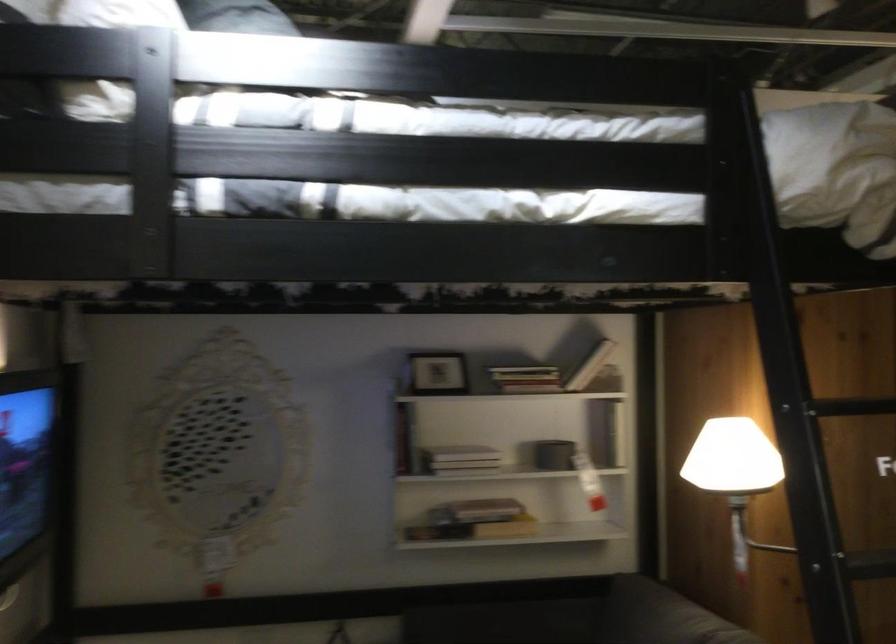
Locate an element on the screen. This screenshot has width=896, height=644. white lamp head is located at coordinates (736, 474).